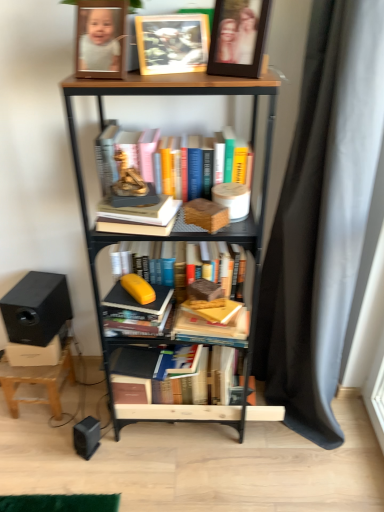
Where is `vacant area that lies between wooden bookcase at center and black fabric curtain at right`? Image resolution: width=384 pixels, height=512 pixels. vacant area that lies between wooden bookcase at center and black fabric curtain at right is located at coordinates (219, 446).